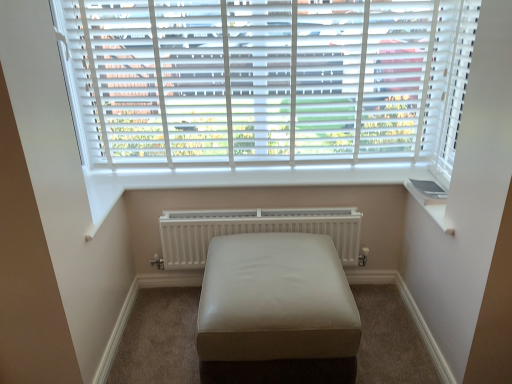
Question: Considering the relative sizes of white matte blinds at upper center and beige leather ottoman at center in the image provided, is white matte blinds at upper center taller than beige leather ottoman at center?

Choices:
 (A) yes
 (B) no

Answer: (A)

Question: Can you confirm if white matte blinds at upper center is bigger than beige leather ottoman at center?

Choices:
 (A) no
 (B) yes

Answer: (A)

Question: Is white matte blinds at upper center far from beige leather ottoman at center?

Choices:
 (A) yes
 (B) no

Answer: (B)

Question: Could beige leather ottoman at center be considered to be inside white matte blinds at upper center?

Choices:
 (A) no
 (B) yes

Answer: (A)

Question: Considering the relative sizes of white matte blinds at upper center and beige leather ottoman at center in the image provided, is white matte blinds at upper center smaller than beige leather ottoman at center?

Choices:
 (A) no
 (B) yes

Answer: (B)

Question: Is white matte blinds at upper center to the right of beige leather ottoman at center from the viewer's perspective?

Choices:
 (A) yes
 (B) no

Answer: (B)

Question: Is white matte radiator at center further to camera compared to white matte blinds at upper center?

Choices:
 (A) yes
 (B) no

Answer: (A)

Question: Does white matte radiator at center have a greater height compared to white matte blinds at upper center?

Choices:
 (A) no
 (B) yes

Answer: (A)

Question: Considering the relative positions of white matte radiator at center and white matte blinds at upper center in the image provided, is white matte radiator at center in front of white matte blinds at upper center?

Choices:
 (A) no
 (B) yes

Answer: (A)

Question: From the image's perspective, would you say white matte radiator at center is positioned over white matte blinds at upper center?

Choices:
 (A) no
 (B) yes

Answer: (A)

Question: Is white matte radiator at center located outside white matte blinds at upper center?

Choices:
 (A) no
 (B) yes

Answer: (B)

Question: Is white matte radiator at center next to white matte blinds at upper center?

Choices:
 (A) yes
 (B) no

Answer: (B)

Question: From a real-world perspective, is beige leather ottoman at center physically above white matte blinds at upper center?

Choices:
 (A) yes
 (B) no

Answer: (B)